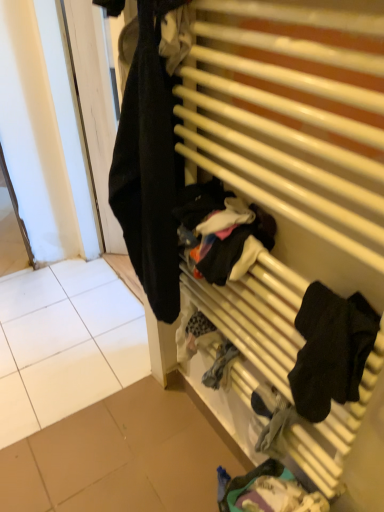
Question: From the image's perspective, is white tile at left below wooden radiator at right?

Choices:
 (A) yes
 (B) no

Answer: (A)

Question: Can you confirm if white tile at left is wider than wooden radiator at right?

Choices:
 (A) yes
 (B) no

Answer: (A)

Question: Is white tile at left outside of wooden radiator at right?

Choices:
 (A) no
 (B) yes

Answer: (B)

Question: Is white tile at left further to the viewer compared to wooden radiator at right?

Choices:
 (A) no
 (B) yes

Answer: (B)

Question: Is white tile at left positioned in front of wooden radiator at right?

Choices:
 (A) no
 (B) yes

Answer: (A)

Question: Is white tile at left thinner than wooden radiator at right?

Choices:
 (A) yes
 (B) no

Answer: (B)

Question: From the image's perspective, is white tile at left on dark blue fabric at lower center, positioned as the 1th clothing in bottom-to-top order?

Choices:
 (A) yes
 (B) no

Answer: (A)

Question: From a real-world perspective, does white tile at left sit lower than dark blue fabric at lower center, positioned as the 1th clothing in bottom-to-top order?

Choices:
 (A) no
 (B) yes

Answer: (B)

Question: Is white tile at left at the right side of dark blue fabric at lower center, positioned as the 1th clothing in bottom-to-top order?

Choices:
 (A) no
 (B) yes

Answer: (A)

Question: From the image's perspective, does white tile at left appear lower than dark blue fabric at lower center, positioned as the 1th clothing in bottom-to-top order?

Choices:
 (A) no
 (B) yes

Answer: (A)

Question: Is white tile at left thinner than dark blue fabric at lower center, positioned as the 1th clothing in bottom-to-top order?

Choices:
 (A) no
 (B) yes

Answer: (A)

Question: Considering the relative sizes of white tile at left and dark blue fabric at lower center, the third clothing positioned from the top, in the image provided, is white tile at left bigger than dark blue fabric at lower center, the third clothing positioned from the top,?

Choices:
 (A) yes
 (B) no

Answer: (A)

Question: Does black fabric socks at right, the 2th clothing from the top, touch white tile at left?

Choices:
 (A) yes
 (B) no

Answer: (B)